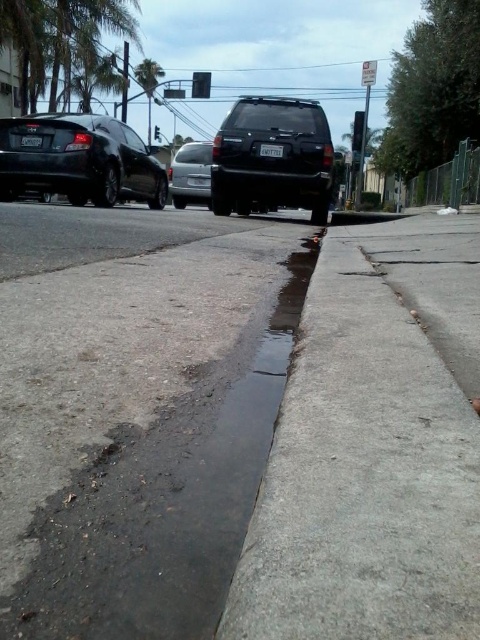
Between point (471, 272) and point (157, 132), which one is positioned behind?

Point (157, 132)

Between point (437, 289) and point (157, 131), which one is positioned in front?

Point (437, 289) is more forward.

What do you see at coordinates (373, 449) in the screenshot? I see `gray concrete curb at lower center` at bounding box center [373, 449].

Find the location of `gray concrete curb at lower center`. gray concrete curb at lower center is located at coordinates (373, 449).

Can you confirm if dull concrete sidewalk at center is thinner than gray concrete curb at lower center?

No.

Can you confirm if dull concrete sidewalk at center is positioned above gray concrete curb at lower center?

Yes.

Locate an element on the screen. Image resolution: width=480 pixels, height=640 pixels. dull concrete sidewalk at center is located at coordinates (135, 410).

At what (x,y) coordinates should I click in order to perform the action: click on dull concrete sidewalk at center. Please return your answer as a coordinate pair (x, y). The width and height of the screenshot is (480, 640). Looking at the image, I should click on (x=135, y=410).

Does satin silver sedan at center have a greater height compared to black glass traffic light at upper center?

In fact, satin silver sedan at center may be shorter than black glass traffic light at upper center.

Can you confirm if satin silver sedan at center is shorter than black glass traffic light at upper center?

Correct, satin silver sedan at center is not as tall as black glass traffic light at upper center.

Is point (202, 182) positioned after point (360, 140)?

No, it is not.

This screenshot has height=640, width=480. Find the location of `satin silver sedan at center`. satin silver sedan at center is located at coordinates (191, 173).